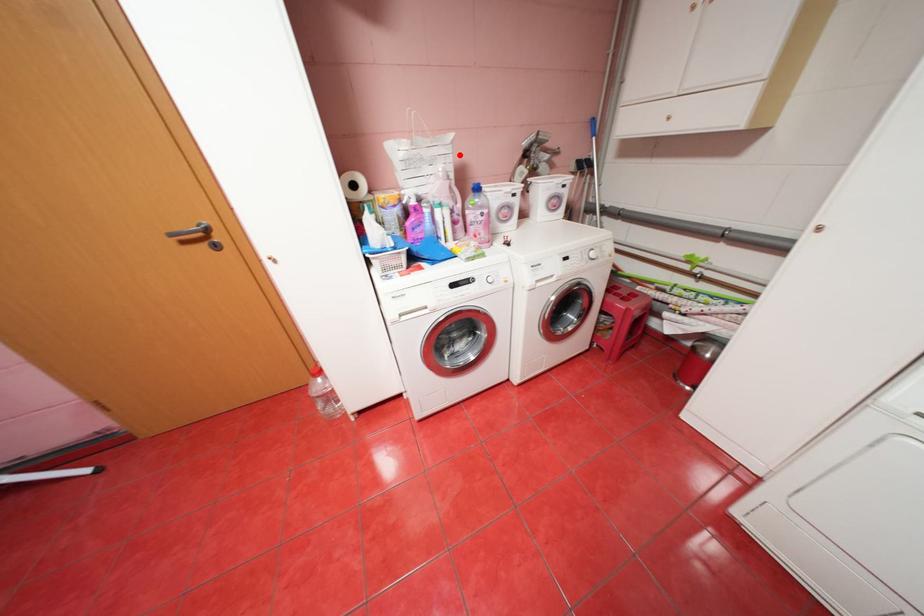
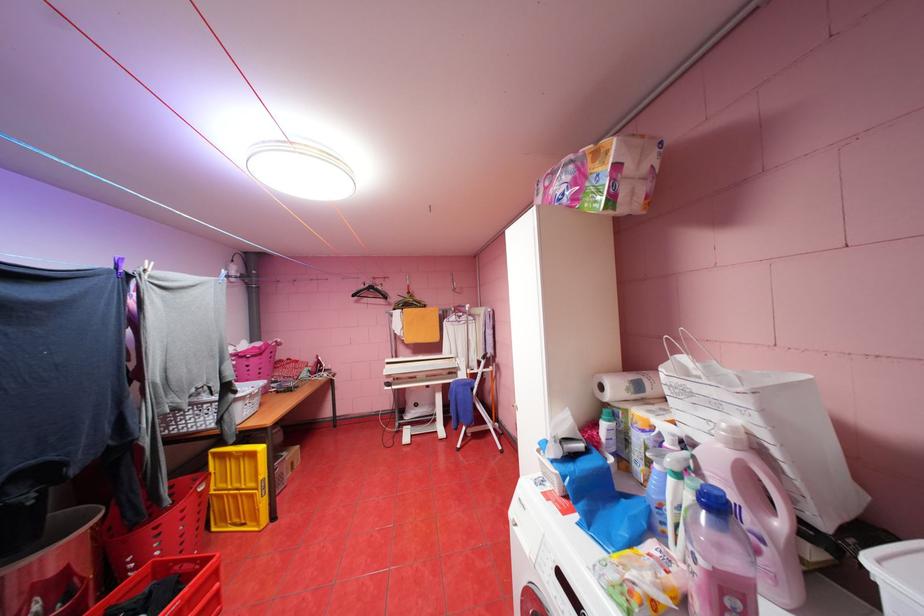
The point at the highlighted location is marked in the first image. Where is the corresponding point in the second image?

(763, 413)